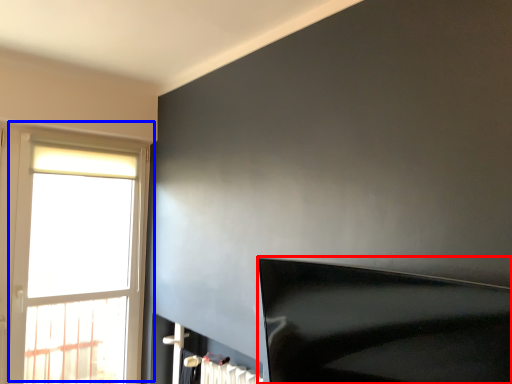
Question: Which object is closer to the camera taking this photo, furniture (highlighted by a red box) or window (highlighted by a blue box)?

Choices:
 (A) furniture
 (B) window

Answer: (A)